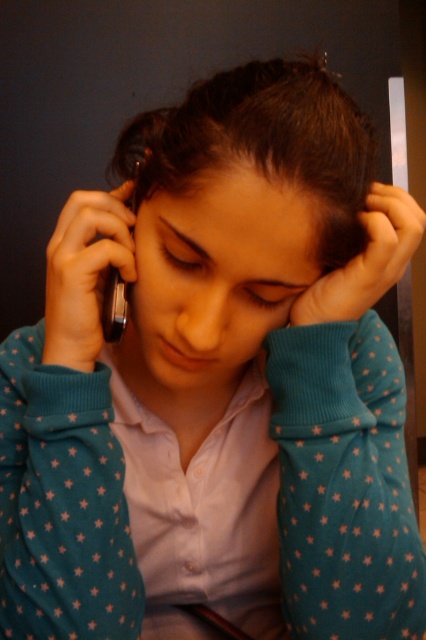
Is blue fabric hand at center wider than black glossy smartphone at left?

Yes, blue fabric hand at center is wider than black glossy smartphone at left.

Which of these two, blue fabric hand at center or black glossy smartphone at left, stands shorter?

Standing shorter between the two is blue fabric hand at center.

What do you see at coordinates (367, 260) in the screenshot? This screenshot has width=426, height=640. I see `blue fabric hand at center` at bounding box center [367, 260].

Identify the location of blue fabric hand at center. The width and height of the screenshot is (426, 640). (367, 260).

Can you confirm if black matte phone at left is thinner than black glossy smartphone at left?

Incorrect, black matte phone at left's width is not less than black glossy smartphone at left's.

From the picture: Is black matte phone at left positioned behind black glossy smartphone at left?

No, it is in front of black glossy smartphone at left.

Where is `black matte phone at left`? The height and width of the screenshot is (640, 426). black matte phone at left is located at coordinates (85, 273).

This screenshot has height=640, width=426. In order to click on black matte phone at left in this screenshot , I will do `click(85, 273)`.

Who is positioned more to the left, matte black phone at center or blue fabric hand at center?

matte black phone at center

Does matte black phone at center come behind blue fabric hand at center?

Result: No, it is not.

Between point (276, 172) and point (371, 259), which one is positioned in front?

Point (276, 172) is in front.

Identify the location of matte black phone at center. (261, 145).